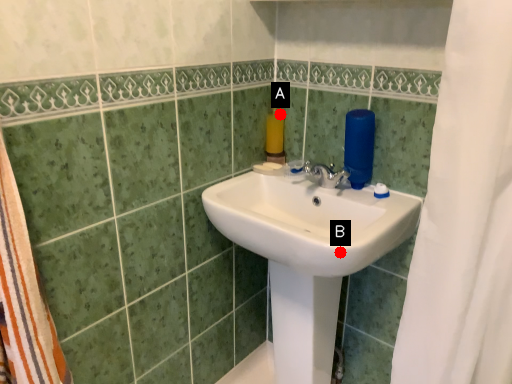
Question: Two points are circled on the image, labeled by A and B beside each circle. Among these points, which one is farthest from the camera?

Choices:
 (A) A is further
 (B) B is further

Answer: (A)